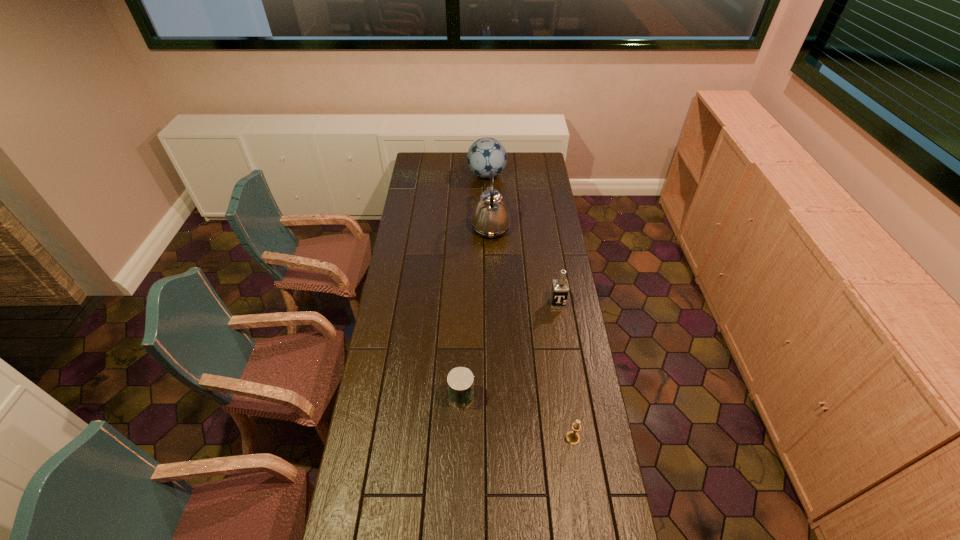
Where is `kettle`? The height and width of the screenshot is (540, 960). kettle is located at coordinates point(490,218).

Find the location of a particular element. the second farthest object is located at coordinates (490, 218).

Find the location of `the farthest object`. the farthest object is located at coordinates (485, 154).

Locate an element on the screen. vodka is located at coordinates (560, 287).

Where is `the third nearest object`? the third nearest object is located at coordinates (560, 287).

The image size is (960, 540). What are the coordinates of `can` in the screenshot? It's located at (460, 380).

Locate an element on the screen. the nearest object is located at coordinates coord(572,437).

Find the location of a particular element. This screenshot has width=960, height=540. vacant space located 0.260m from the spout of the tallest object is located at coordinates (421, 228).

At what (x,y) coordinates should I click in order to perform the action: click on vacant space located from the spout of the tallest object. Please return your answer as a coordinate pair (x, y). The image size is (960, 540). Looking at the image, I should click on (431, 228).

At what (x,y) coordinates should I click in order to perform the action: click on vacant point located from the spout of the tallest object. Please return your answer as a coordinate pair (x, y). Looking at the image, I should click on (408, 228).